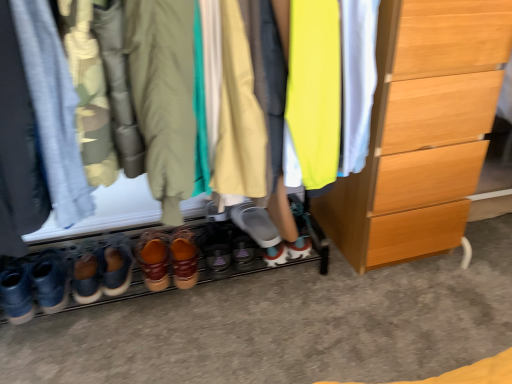
Where is `vacant area that is in front of leather boots at center, which is counted as the fourth footwear, starting from the left`? The image size is (512, 384). vacant area that is in front of leather boots at center, which is counted as the fourth footwear, starting from the left is located at coordinates (159, 340).